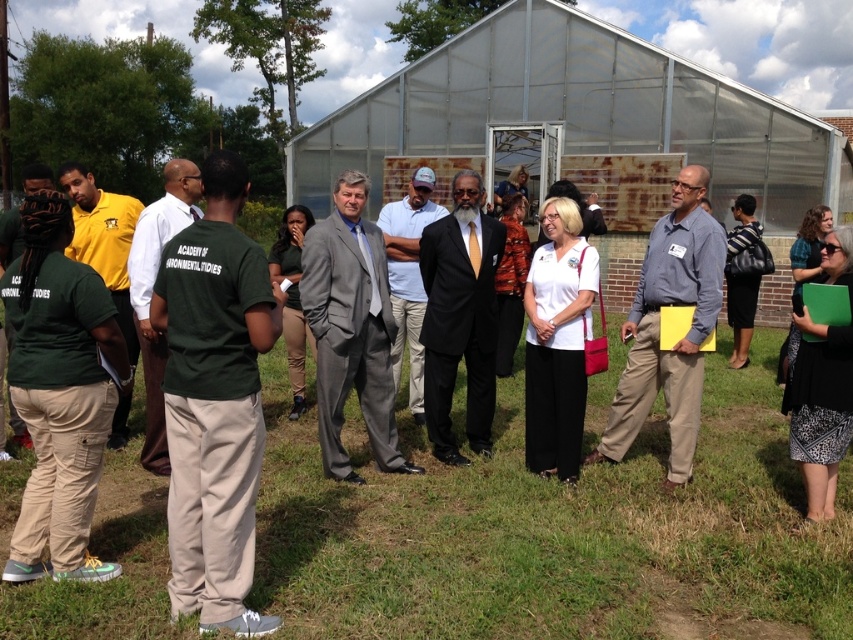
You are a photographer standing at the entrance of the greenhouse. You want to take a photo that includes both the matte yellow shirt at left and the light blue shirt at center. What is the minimum distance you need to move backward to ensure both shirts are fully visible in the frame?

The matte yellow shirt at left is 2.06 meters from the light blue shirt at center. To capture both in the frame, you need to move backward until the distance between them fits within your camera lens field of view. Assuming a standard lens with a 50mm focal length, the minimum distance would be approximately 2.06 meters divided by the angle of view, but without specific camera details, it is recommended to move back at least 3 meters to ensure both shirts are visible.

You are standing in front of the greenhouse and notice two people wearing the black satin suit at center and the green matte shirt at left. Which person is standing closer to the greenhouse entrance?

The black satin suit at center is positioned under the green matte shirt at left, meaning it is closer to the entrance of the greenhouse since it is lower in the image.